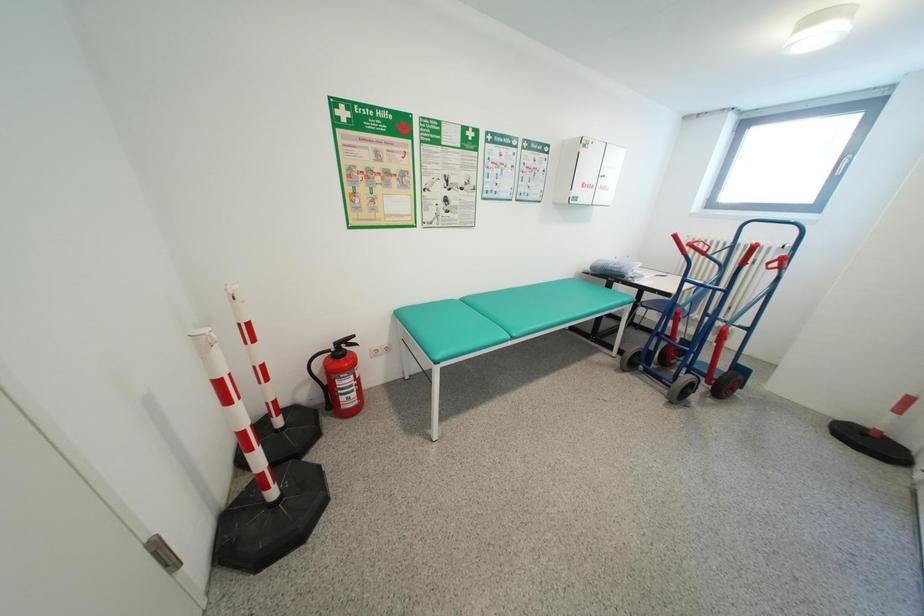
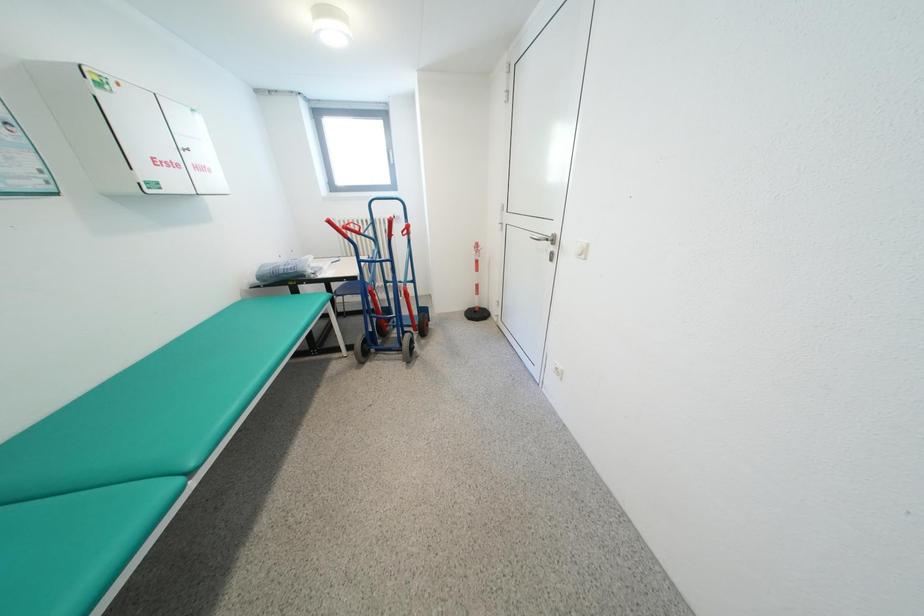
First-person continuous shooting, in which direction is the camera rotating?

The camera rotated toward right-down.